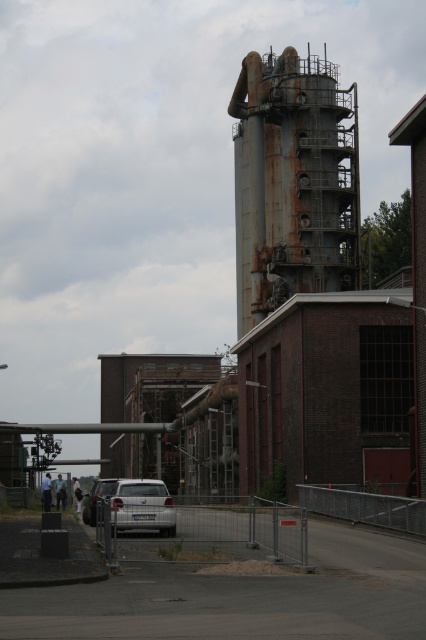
Question: Based on their relative distances, which object is nearer to the rusty metal water tower at center?

Choices:
 (A) satin silver car at center
 (B) white matte car at lower left

Answer: (B)

Question: Which of the following is the closest to the observer?

Choices:
 (A) click(244, 74)
 (B) click(97, 481)

Answer: (B)

Question: Does satin silver car at center have a larger size compared to white matte car at lower left?

Choices:
 (A) no
 (B) yes

Answer: (A)

Question: Is rusty metal water tower at center above white matte car at lower left?

Choices:
 (A) yes
 (B) no

Answer: (A)

Question: Among these objects, which one is farthest from the camera?

Choices:
 (A) satin silver car at center
 (B) rusty metal water tower at center
 (C) white matte car at lower left

Answer: (B)

Question: Is rusty metal water tower at center closer to the viewer compared to white matte car at lower left?

Choices:
 (A) yes
 (B) no

Answer: (B)